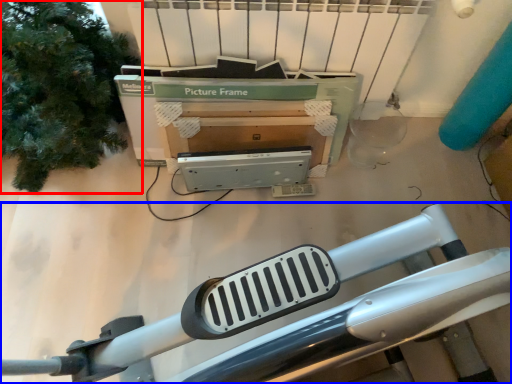
Question: Which object is further to the camera taking this photo, tree (highlighted by a red box) or furniture (highlighted by a blue box)?

Choices:
 (A) tree
 (B) furniture

Answer: (B)